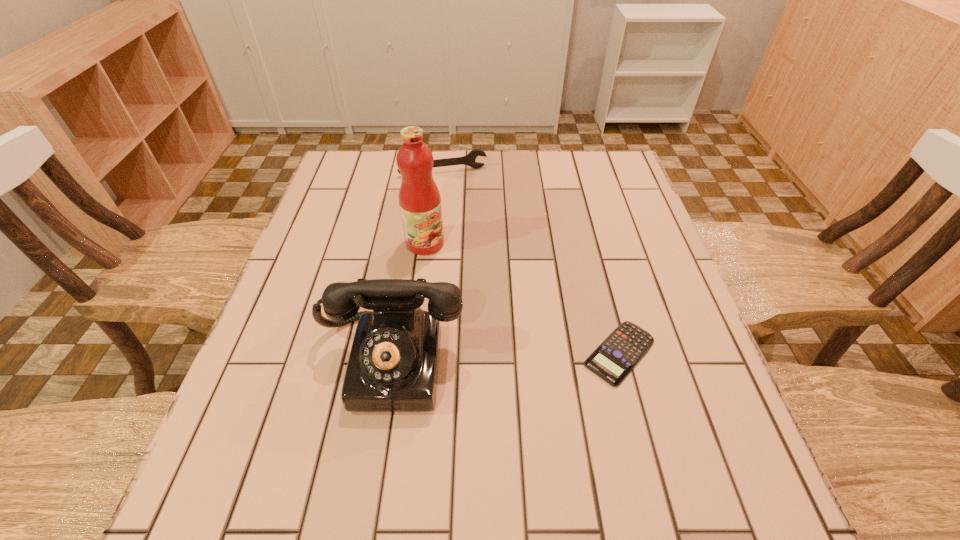
Find the location of a particular element. Image resolution: width=960 pixels, height=540 pixels. free point between the rightmost object and the tallest object is located at coordinates (522, 298).

Locate an element on the screen. This screenshot has width=960, height=540. free space between the farthest object and the telephone is located at coordinates point(417,266).

Locate an element on the screen. This screenshot has height=540, width=960. empty space between the calculator and the third nearest object is located at coordinates (522, 298).

This screenshot has width=960, height=540. Identify the location of object that is the second closest to the telephone. [620, 352].

Point out which object is positioned as the nearest to the shortest object. Please provide its 2D coordinates. Your answer should be formatted as a tuple, i.e. [(x, y)], where the tuple contains the x and y coordinates of a point satisfying the conditions above.

[(393, 364)]